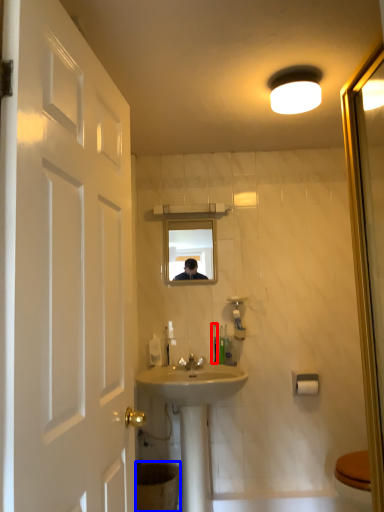
Question: Which object appears farthest to the camera in this image, toothbrush (highlighted by a red box) or toilet bowl (highlighted by a blue box)?

Choices:
 (A) toothbrush
 (B) toilet bowl

Answer: (A)